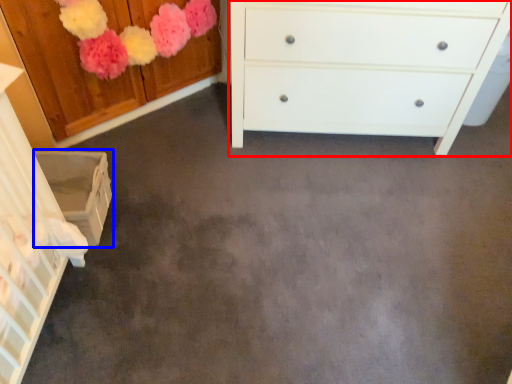
Question: Which point is further to the camera, chest of drawers (highlighted by a red box) or cabinetry (highlighted by a blue box)?

Choices:
 (A) chest of drawers
 (B) cabinetry

Answer: (A)